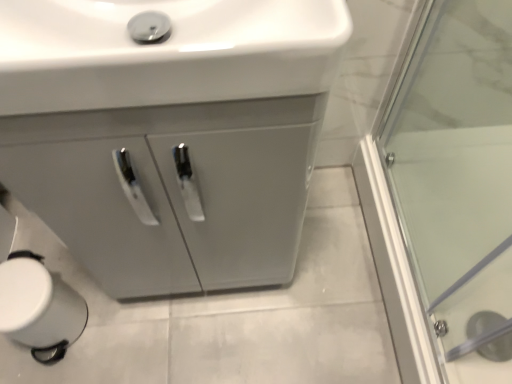
Where is `unoccupied region to the right of matte gray cabinet at center`? Image resolution: width=512 pixels, height=384 pixels. unoccupied region to the right of matte gray cabinet at center is located at coordinates (331, 264).